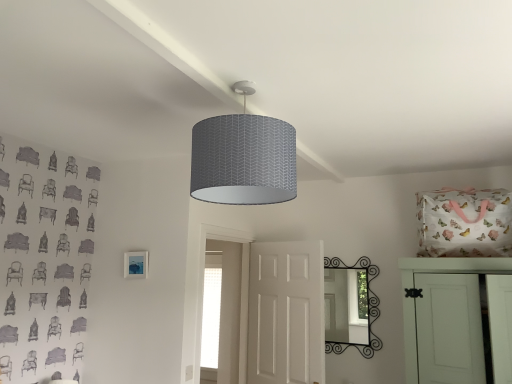
What is the approximate width of white matte door at center, which ranks as the second door in right-to-left order?

It is 3.62 inches.

Locate an element on the screen. The height and width of the screenshot is (384, 512). gray fabric lampshade at upper center is located at coordinates (243, 158).

Does gray fabric lampshade at upper center have a smaller size compared to white matte door at center, which ranks as the second door in right-to-left order?

Correct, gray fabric lampshade at upper center occupies less space than white matte door at center, which ranks as the second door in right-to-left order.

Identify the location of lamp in front of the white matte door at center, which ranks as the second door in right-to-left order. The image size is (512, 384). (243, 158).

In the scene shown: Who is taller, matte blue picture frame at lower left or white matte door at center, the first door when ordered from left to right?

white matte door at center, the first door when ordered from left to right.

Between matte blue picture frame at lower left and white matte door at center, the first door when ordered from left to right, which one appears on the right side from the viewer's perspective?

white matte door at center, the first door when ordered from left to right.

The image size is (512, 384). In order to click on picture frame in front of the white matte door at center, which ranks as the second door in right-to-left order in this screenshot , I will do `click(136, 265)`.

In the image, is black wrought iron mirror at center positioned in front of or behind gray fabric lampshade at upper center?

In the image, black wrought iron mirror at center appears behind gray fabric lampshade at upper center.

Who is taller, black wrought iron mirror at center or gray fabric lampshade at upper center?

black wrought iron mirror at center.

Is gray fabric lampshade at upper center at the back of black wrought iron mirror at center?

black wrought iron mirror at center does not have its back to gray fabric lampshade at upper center.

Measure the distance from black wrought iron mirror at center to gray fabric lampshade at upper center.

They are 2.09 meters apart.

At what (x,y) coordinates should I click in order to perform the action: click on door to the left of black wrought iron mirror at center. Please return your answer as a coordinate pair (x, y). This screenshot has width=512, height=384. Looking at the image, I should click on (286, 313).

In the scene shown: From the image's perspective, is black wrought iron mirror at center under white matte door at center, the first door when ordered from left to right?

No, from the image's perspective, black wrought iron mirror at center is not beneath white matte door at center, the first door when ordered from left to right.

Considering the relative positions of black wrought iron mirror at center and white matte door at center, which ranks as the second door in right-to-left order, in the image provided, is black wrought iron mirror at center to the left of white matte door at center, which ranks as the second door in right-to-left order, from the viewer's perspective?

No, black wrought iron mirror at center is not to the left of white matte door at center, which ranks as the second door in right-to-left order.

Consider the image. Can you confirm if black wrought iron mirror at center is shorter than white matte door at center, the first door when ordered from left to right?

Yes, black wrought iron mirror at center is shorter than white matte door at center, the first door when ordered from left to right.

Which object is positioned more to the left, gray fabric lampshade at upper center or black wrought iron mirror at center?

From the viewer's perspective, gray fabric lampshade at upper center appears more on the left side.

Is black wrought iron mirror at center at the back of gray fabric lampshade at upper center?

That's not correct — gray fabric lampshade at upper center is not looking away from black wrought iron mirror at center.

Are gray fabric lampshade at upper center and black wrought iron mirror at center located far from each other?

Yes, gray fabric lampshade at upper center and black wrought iron mirror at center are located far from each other.

How different are the orientations of gray fabric lampshade at upper center and black wrought iron mirror at center in degrees?

177 degrees.

Considering the relative positions of white matte cabinet door at right, the 1th door viewed from the right, and matte blue picture frame at lower left in the image provided, is white matte cabinet door at right, the 1th door viewed from the right, in front of matte blue picture frame at lower left?

Yes, white matte cabinet door at right, the 1th door viewed from the right, is closer to the viewer.

Which of these two, white matte cabinet door at right, the 1th door viewed from the right, or matte blue picture frame at lower left, is wider?

Wider between the two is white matte cabinet door at right, the 1th door viewed from the right.

How different are the orientations of white matte cabinet door at right, the 1th door viewed from the right, and matte blue picture frame at lower left in degrees?

There is a 5.49-degree angle between the facing directions of white matte cabinet door at right, the 1th door viewed from the right, and matte blue picture frame at lower left.

Is gray fabric lampshade at upper center positioned beyond the bounds of white matte cabinet door at right, placed as the second door when sorted from left to right?

That's correct, gray fabric lampshade at upper center is outside of white matte cabinet door at right, placed as the second door when sorted from left to right.

Which object is further away from the camera, gray fabric lampshade at upper center or white matte cabinet door at right, placed as the second door when sorted from left to right?

white matte cabinet door at right, placed as the second door when sorted from left to right, is further away from the camera.

Considering the relative positions of gray fabric lampshade at upper center and white matte cabinet door at right, placed as the second door when sorted from left to right, in the image provided, is gray fabric lampshade at upper center to the right of white matte cabinet door at right, placed as the second door when sorted from left to right, from the viewer's perspective?

No, gray fabric lampshade at upper center is not to the right of white matte cabinet door at right, placed as the second door when sorted from left to right.

From the picture: Is the surface of gray fabric lampshade at upper center in direct contact with white matte cabinet door at right, the 1th door viewed from the right?

gray fabric lampshade at upper center and white matte cabinet door at right, the 1th door viewed from the right, are not in contact.

This screenshot has width=512, height=384. I want to click on the 1st door to the right of the gray fabric lampshade at upper center, counting from the anchor's position, so click(x=286, y=313).

Identify the location of picture frame that is in front of the white matte door at center, which ranks as the second door in right-to-left order. This screenshot has height=384, width=512. (136, 265).

Estimate the real-world distances between objects in this image. Which object is closer to black wrought iron mirror at center, white matte door at center, which ranks as the second door in right-to-left order, or gray fabric lampshade at upper center?

Among the two, white matte door at center, which ranks as the second door in right-to-left order, is located nearer to black wrought iron mirror at center.

Looking at the image, which one is located closer to matte blue picture frame at lower left, white matte door at center, the first door when ordered from left to right, or gray fabric lampshade at upper center?

white matte door at center, the first door when ordered from left to right.

Looking at the image, which one is located further to gray fabric lampshade at upper center, white matte door at center, the first door when ordered from left to right, or black wrought iron mirror at center?

Among the two, black wrought iron mirror at center is located further to gray fabric lampshade at upper center.

Estimate the real-world distances between objects in this image. Which object is closer to matte blue picture frame at lower left, white matte cabinet door at right, placed as the second door when sorted from left to right, or white matte door at center, the first door when ordered from left to right?

white matte door at center, the first door when ordered from left to right.

Considering their positions, is white matte cabinet door at right, placed as the second door when sorted from left to right, positioned further to gray fabric lampshade at upper center than black wrought iron mirror at center?

black wrought iron mirror at center is further to gray fabric lampshade at upper center.

Looking at the image, which one is located closer to matte blue picture frame at lower left, white matte door at center, the first door when ordered from left to right, or white matte cabinet door at right, the 1th door viewed from the right?

Among the two, white matte door at center, the first door when ordered from left to right, is located nearer to matte blue picture frame at lower left.

From the image, which object appears to be farther from black wrought iron mirror at center, matte blue picture frame at lower left or gray fabric lampshade at upper center?

The object further to black wrought iron mirror at center is gray fabric lampshade at upper center.

Based on their spatial positions, is white matte cabinet door at right, placed as the second door when sorted from left to right, or white matte door at center, the first door when ordered from left to right, closer to black wrought iron mirror at center?

Based on the image, white matte door at center, the first door when ordered from left to right, appears to be nearer to black wrought iron mirror at center.

You are a GUI agent. You are given a task and a screenshot of the screen. Output one action in this format:
    pyautogui.click(x=<x>, y=<y>)
    Task: Click on the lamp between matte blue picture frame at lower left and white matte cabinet door at right, placed as the second door when sorted from left to right, in the horizontal direction
    The height and width of the screenshot is (384, 512).
    Given the screenshot: What is the action you would take?
    pyautogui.click(x=243, y=158)

Find the location of `picture frame between gray fabric lampshade at upper center and white matte door at center, which ranks as the second door in right-to-left order, along the z-axis`. picture frame between gray fabric lampshade at upper center and white matte door at center, which ranks as the second door in right-to-left order, along the z-axis is located at coordinates (136, 265).

I want to click on picture frame between gray fabric lampshade at upper center and black wrought iron mirror at center in the front-back direction, so click(x=136, y=265).

At what (x,y) coordinates should I click in order to perform the action: click on door located between matte blue picture frame at lower left and black wrought iron mirror at center in the left-right direction. Please return your answer as a coordinate pair (x, y). This screenshot has height=384, width=512. Looking at the image, I should click on (286, 313).